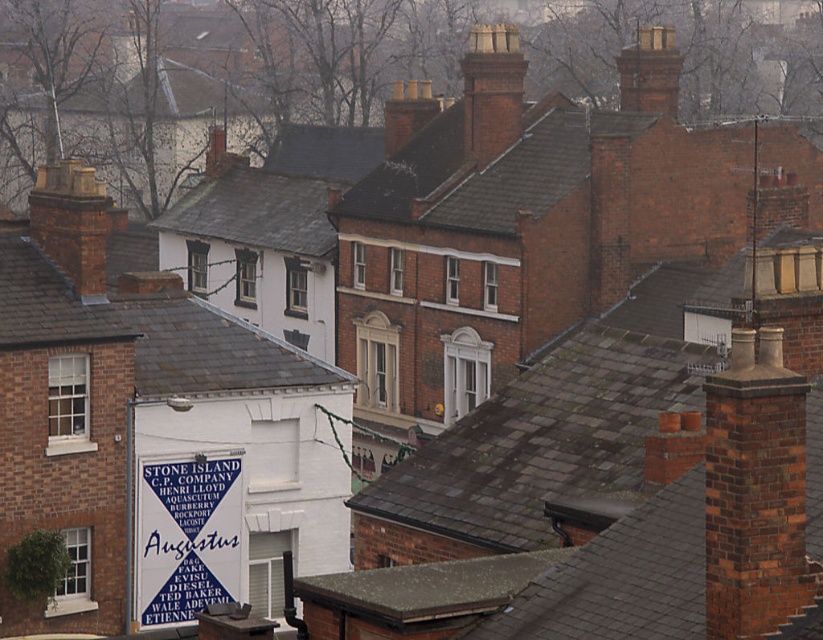
You are a delivery person trying to locate the Augustus building. You see the blue paper sign at center and the red brick chimney at upper right. Which object is positioned lower in the image?

The blue paper sign at center is below the red brick chimney at upper right, so the blue paper sign at center is positioned lower in the image.

You are a delivery person holding a package that is 1.2 meters wide. You need to place it between the blue paper sign at center and the red brick chimney at center. Can the package fit between them?

The blue paper sign at center has a lesser width compared to red brick chimney at center, so the space between them may be sufficient. However, since the package is 1.2 meters wide, we need to know the exact distance between the two objects to determine if it fits. The provided information only states the relative widths of the objects, not the distance between them.

You are a delivery person trying to deliver a package to the red brick chimney at center. However, you notice another red brick chimney at upper right. Which chimney is bigger and requires more materials for maintenance?

The red brick chimney at center is larger in size compared to the red brick chimney at upper right, so it would require more materials for maintenance.